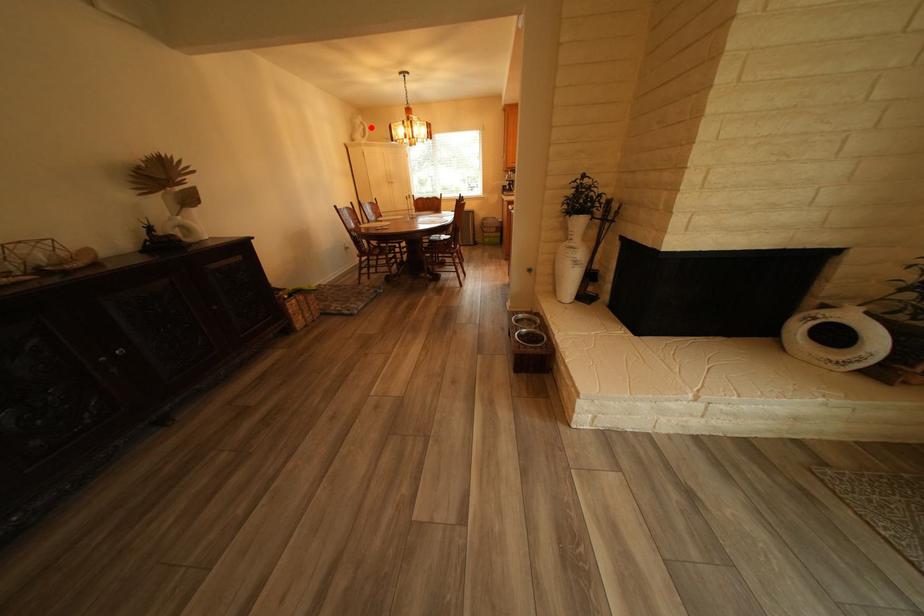
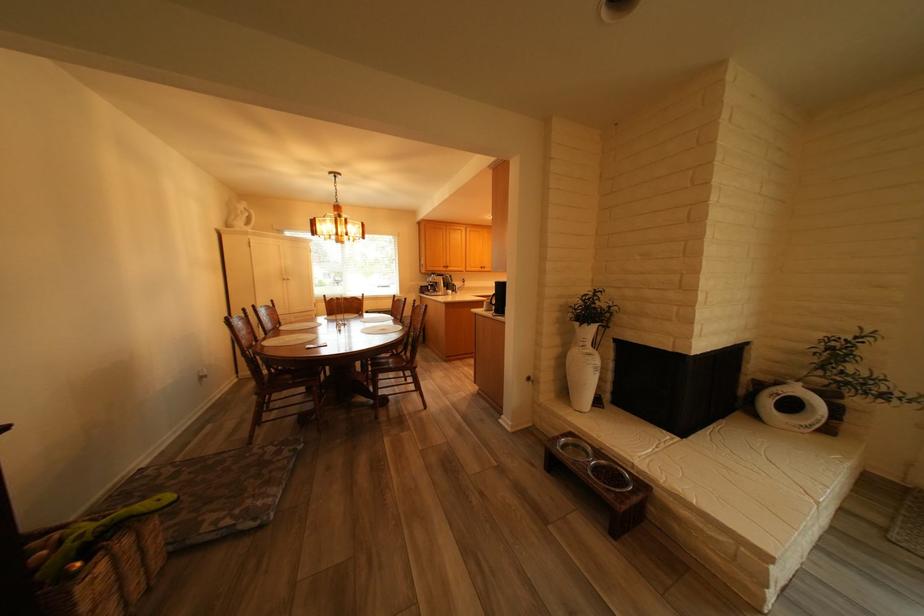
Find the pixel in the second image that matches the highlighted location in the first image.

(253, 213)